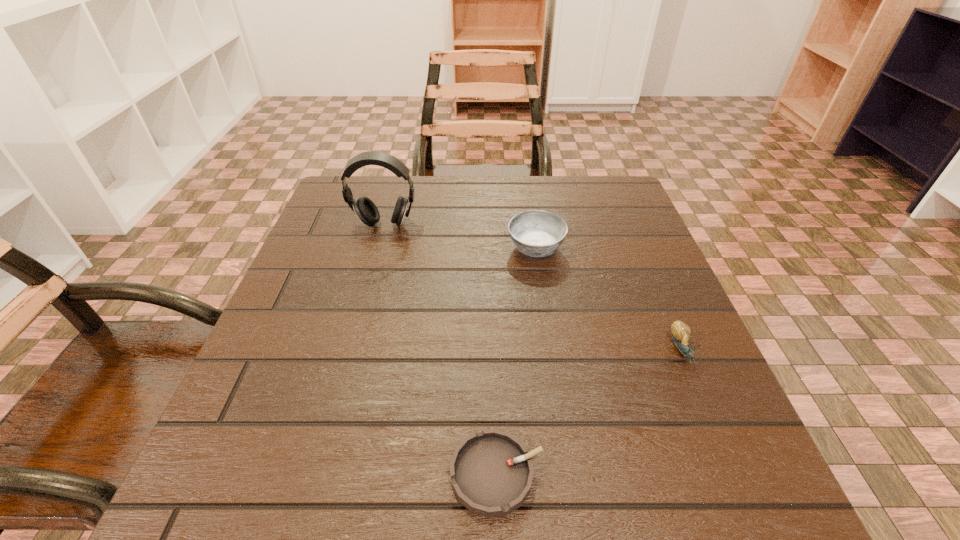
Find the location of a particular element. The height and width of the screenshot is (540, 960). free spot located on the front-facing side of the rightmost object is located at coordinates (724, 448).

Find the location of `free space located on the left of the nearest object`. free space located on the left of the nearest object is located at coordinates (198, 474).

At what (x,y) coordinates should I click in order to perform the action: click on object that is positioned at the far edge. Please return your answer as a coordinate pair (x, y). Looking at the image, I should click on (363, 207).

The width and height of the screenshot is (960, 540). I want to click on object that is at the near edge, so click(491, 471).

You are a GUI agent. You are given a task and a screenshot of the screen. Output one action in this format:
    pyautogui.click(x=<x>, y=<y>)
    Task: Click on the object present at the left edge
    
    Given the screenshot: What is the action you would take?
    pyautogui.click(x=363, y=207)

Where is `object present at the right edge`? This screenshot has height=540, width=960. object present at the right edge is located at coordinates (681, 332).

This screenshot has width=960, height=540. In order to click on object that is at the far left corner in this screenshot , I will do `click(363, 207)`.

In the image, there is a desktop. Find the location of `vacant space at the far edge`. vacant space at the far edge is located at coordinates (455, 178).

Identify the location of vacant region at the near edge of the desktop. [609, 489].

This screenshot has height=540, width=960. In the image, there is a desktop. What are the coordinates of `vacant area at the left edge` in the screenshot? It's located at (368, 241).